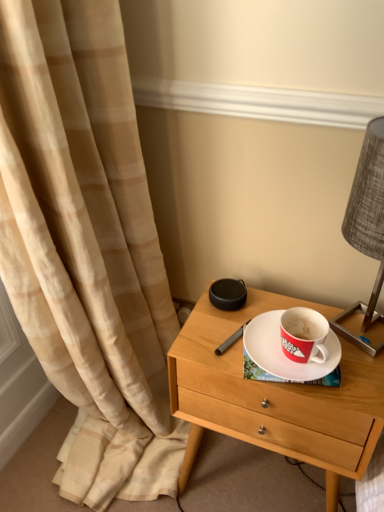
What do you see at coordinates (285, 356) in the screenshot?
I see `white matte saucer at center` at bounding box center [285, 356].

You are a GUI agent. You are given a task and a screenshot of the screen. Output one action in this format:
    pyautogui.click(x=<x>, y=<y>)
    Task: Click on the white matte saucer at center
    This screenshot has height=512, width=384.
    Given the screenshot: What is the action you would take?
    pyautogui.click(x=285, y=356)

What do you see at coordinates (274, 397) in the screenshot? I see `light wood/finish nightstand at center` at bounding box center [274, 397].

In order to face textured gray lampshade at right, should I rotate leftwards or rightwards?

You should look right and rotate roughly 23.188 degrees.

Locate an element on the screen. The height and width of the screenshot is (512, 384). white matte saucer at center is located at coordinates (285, 356).

Is white matte saucer at center inside the boundaries of light wood/finish nightstand at center, or outside?

white matte saucer at center is not enclosed by light wood/finish nightstand at center.

Does white matte saucer at center have a greater width compared to light wood/finish nightstand at center?

No.

Who is smaller, white matte saucer at center or light wood/finish nightstand at center?

Smaller between the two is white matte saucer at center.

Would you say white matte saucer at center is to the left or to the right of light wood/finish nightstand at center in the picture?

white matte saucer at center is positioned on light wood/finish nightstand at center's right side.

Is light wood/finish nightstand at center spatially inside white matte saucer at center, or outside of it?

light wood/finish nightstand at center lies outside white matte saucer at center.

Is light wood/finish nightstand at center to the left of white matte saucer at center from the viewer's perspective?

Yes.

Considering the positions of point (183, 471) and point (270, 351), is point (183, 471) closer or farther from the camera than point (270, 351)?

Point (183, 471) appears to be farther away from the viewer than point (270, 351).

From their relative heights in the image, would you say textured gray lampshade at right is taller or shorter than white matte saucer at center?

Clearly, textured gray lampshade at right is taller compared to white matte saucer at center.

Is textured gray lampshade at right directly adjacent to white matte saucer at center?

No, textured gray lampshade at right is not with white matte saucer at center.

Find the location of a particular element. The height and width of the screenshot is (512, 384). bedside lamp on the right of white matte saucer at center is located at coordinates (366, 229).

Measure the distance from textured gray lampshade at right to white matte saucer at center.

textured gray lampshade at right and white matte saucer at center are 11.54 inches apart.

From the picture: Is light wood/finish nightstand at center oriented away from textured gray lampshade at right?

That's not correct — light wood/finish nightstand at center is not looking away from textured gray lampshade at right.

From a real-world perspective, is light wood/finish nightstand at center positioned above or below textured gray lampshade at right?

From a real-world perspective, light wood/finish nightstand at center is physically below textured gray lampshade at right.

Considering the relative sizes of light wood/finish nightstand at center and textured gray lampshade at right in the image provided, is light wood/finish nightstand at center taller than textured gray lampshade at right?

Correct, light wood/finish nightstand at center is much taller as textured gray lampshade at right.

Is light wood/finish nightstand at center to the left of textured gray lampshade at right from the viewer's perspective?

Yes.

Would you say light wood/finish nightstand at center is part of textured gray lampshade at right's contents?

No, textured gray lampshade at right does not contain light wood/finish nightstand at center.

Is textured gray lampshade at right bigger or smaller than light wood/finish nightstand at center?

Considering their sizes, textured gray lampshade at right takes up less space than light wood/finish nightstand at center.

Does textured gray lampshade at right come in front of light wood/finish nightstand at center?

Yes, textured gray lampshade at right is in front of light wood/finish nightstand at center.

Where is `bedside lamp above the white matte saucer at center (from the image's perspective)`? bedside lamp above the white matte saucer at center (from the image's perspective) is located at coordinates (366, 229).

Considering the sizes of objects white matte saucer at center and textured gray lampshade at right in the image provided, who is smaller, white matte saucer at center or textured gray lampshade at right?

white matte saucer at center is smaller.

Measure the distance between white matte saucer at center and textured gray lampshade at right.

They are 11.54 inches apart.

In terms of width, does white matte saucer at center look wider or thinner when compared to textured gray lampshade at right?

In the image, white matte saucer at center appears to be more narrow than textured gray lampshade at right.

Image resolution: width=384 pixels, height=512 pixels. Find the location of `saucer on the right of the light wood/finish nightstand at center`. saucer on the right of the light wood/finish nightstand at center is located at coordinates (285, 356).

Find the location of a particular element. saucer above the light wood/finish nightstand at center (from the image's perspective) is located at coordinates (x=285, y=356).

Estimate the real-world distances between objects in this image. Which object is further from white matte saucer at center, light wood/finish nightstand at center or textured gray lampshade at right?

Among the two, textured gray lampshade at right is located further to white matte saucer at center.

When comparing their distances from textured gray lampshade at right, does white matte saucer at center or light wood/finish nightstand at center seem further?

light wood/finish nightstand at center lies further to textured gray lampshade at right than the other object.

Based on the photo, based on their spatial positions, is white matte saucer at center or textured gray lampshade at right further from light wood/finish nightstand at center?

The object further to light wood/finish nightstand at center is textured gray lampshade at right.

When comparing their distances from white matte saucer at center, does textured gray lampshade at right or light wood/finish nightstand at center seem closer?

Based on the image, light wood/finish nightstand at center appears to be nearer to white matte saucer at center.

When comparing their distances from textured gray lampshade at right, does light wood/finish nightstand at center or white matte saucer at center seem closer?

Based on the image, white matte saucer at center appears to be nearer to textured gray lampshade at right.

Estimate the real-world distances between objects in this image. Which object is closer to light wood/finish nightstand at center, textured gray lampshade at right or white matte saucer at center?

Based on the image, white matte saucer at center appears to be nearer to light wood/finish nightstand at center.

Locate an element on the screen. saucer that lies between textured gray lampshade at right and light wood/finish nightstand at center from top to bottom is located at coordinates (285, 356).